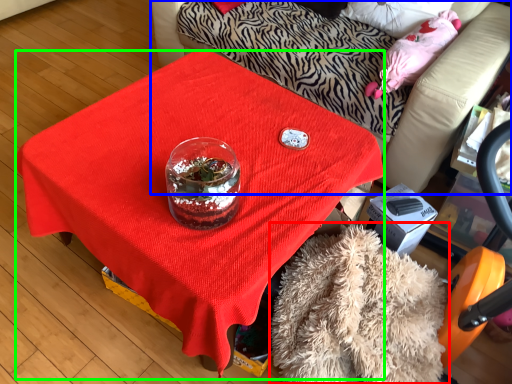
Question: Which object is positioned closest to blanket (highlighted by a red box)? Select from furniture (highlighted by a blue box) and desk (highlighted by a green box).

Choices:
 (A) furniture
 (B) desk

Answer: (B)